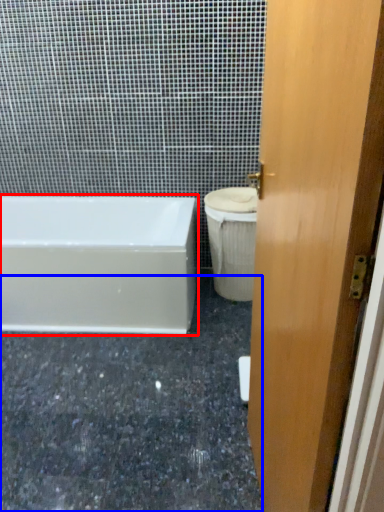
Question: Among these objects, which one is nearest to the camera, bathtub (highlighted by a red box) or granite (highlighted by a blue box)?

Choices:
 (A) bathtub
 (B) granite

Answer: (B)